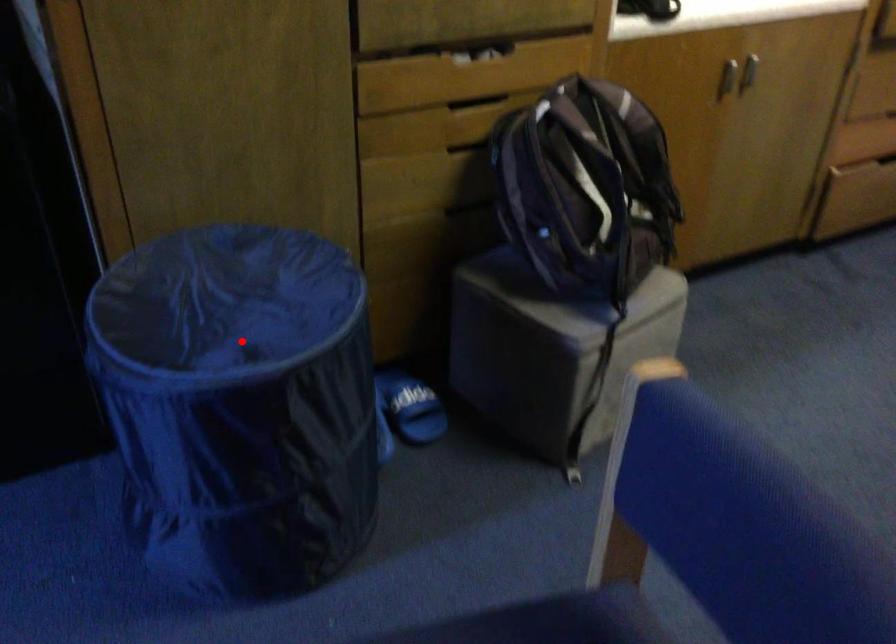
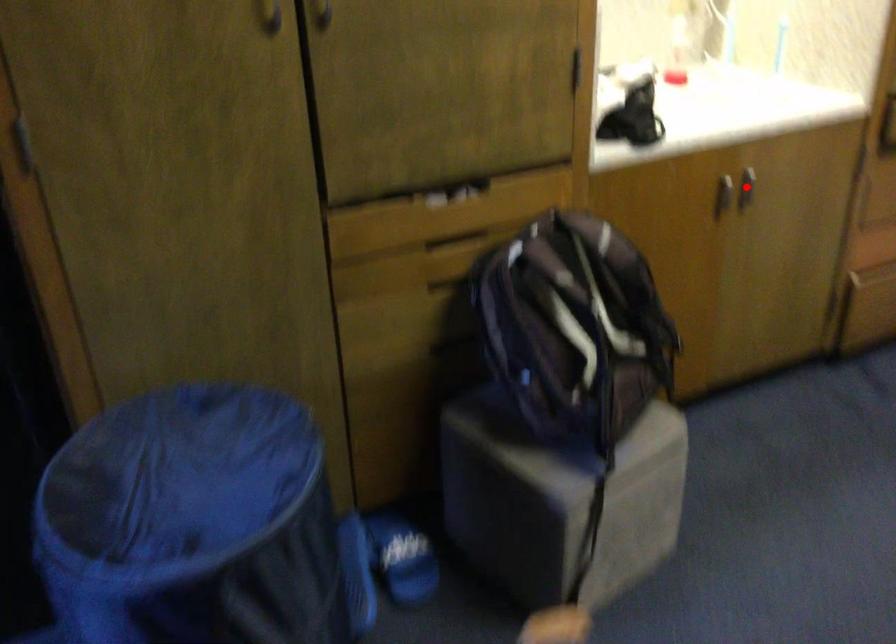
I am providing you with two images of the same scene from different viewpoints. A red point is marked on the first image and another point is marked on the second image. Does the point marked in image1 correspond to the same location as the one in image2?

No